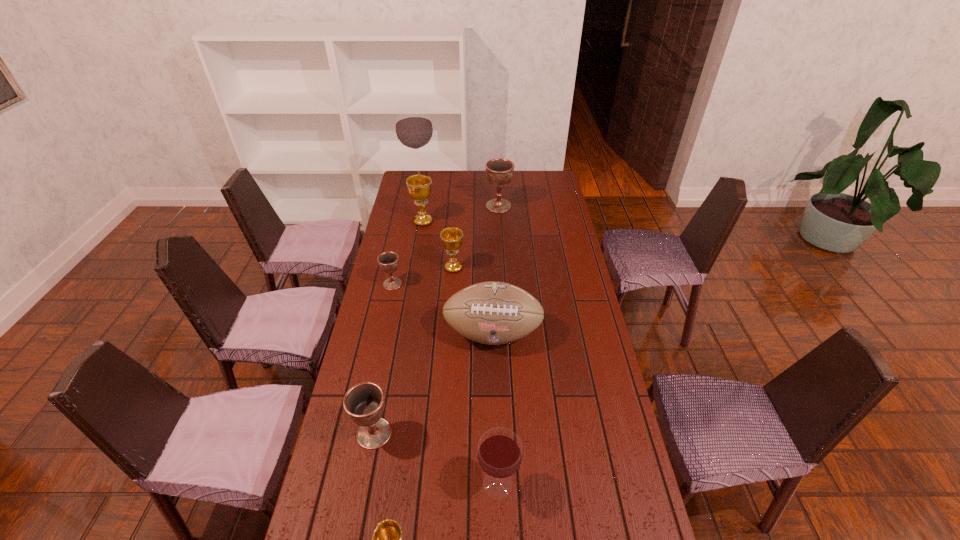
Where is `vacant region located 0.190m on the left of the sixth nearest object`? This screenshot has width=960, height=540. vacant region located 0.190m on the left of the sixth nearest object is located at coordinates (397, 268).

The height and width of the screenshot is (540, 960). I want to click on free space located on the back of the nearest brown chalice, so click(394, 329).

Where is `free space located 0.100m on the right of the second nearest brown chalice`? free space located 0.100m on the right of the second nearest brown chalice is located at coordinates (427, 284).

Find the location of a particular element. The image size is (960, 540). object that is positioned at the far edge is located at coordinates (414, 129).

This screenshot has height=540, width=960. What are the coordinates of `alcohol present at the left edge` in the screenshot? It's located at pos(414,129).

The width and height of the screenshot is (960, 540). I want to click on object that is at the far left corner, so click(414, 129).

This screenshot has width=960, height=540. I want to click on blank space at the far edge, so click(x=486, y=176).

This screenshot has width=960, height=540. Identify the location of vacant space at the left edge. (385, 247).

In the image, there is a desktop. Where is `vacant space at the right edge`? vacant space at the right edge is located at coordinates (562, 246).

Image resolution: width=960 pixels, height=540 pixels. Identify the location of blank space at the far left corner of the desktop. (415, 172).